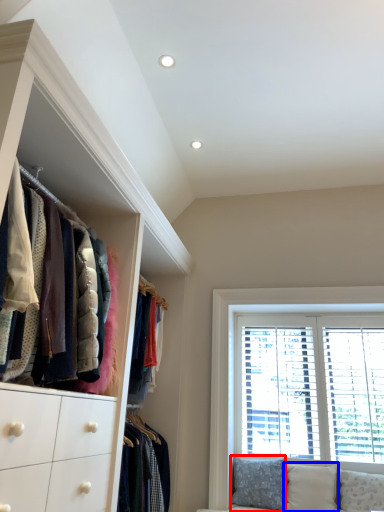
Question: Which object is further to the camera taking this photo, pillow (highlighted by a red box) or pillow (highlighted by a blue box)?

Choices:
 (A) pillow
 (B) pillow

Answer: (A)